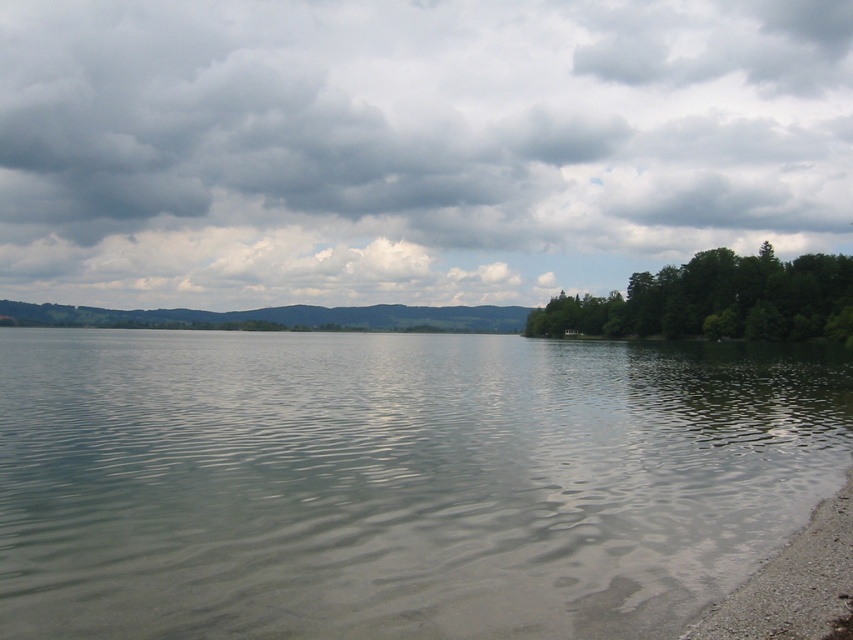
Question: Is green leafy trees at right smaller than gray gravel shoreline at lower right?

Choices:
 (A) no
 (B) yes

Answer: (A)

Question: Which object is the closest to the clear water at lower right?

Choices:
 (A) gray gravel shoreline at lower right
 (B) cloudy sky at upper center

Answer: (A)

Question: Is clear water at lower right positioned in front of gray gravel shoreline at lower right?

Choices:
 (A) no
 (B) yes

Answer: (B)

Question: Can you confirm if cloudy sky at upper center is positioned below green leafy trees at right?

Choices:
 (A) yes
 (B) no

Answer: (B)

Question: Among these points, which one is nearest to the camera?

Choices:
 (A) (74, 540)
 (B) (752, 284)
 (C) (682, 637)

Answer: (C)

Question: Which is farther from the green leafy trees at right?

Choices:
 (A) clear water at lower right
 (B) gray gravel shoreline at lower right
 (C) cloudy sky at upper center

Answer: (C)